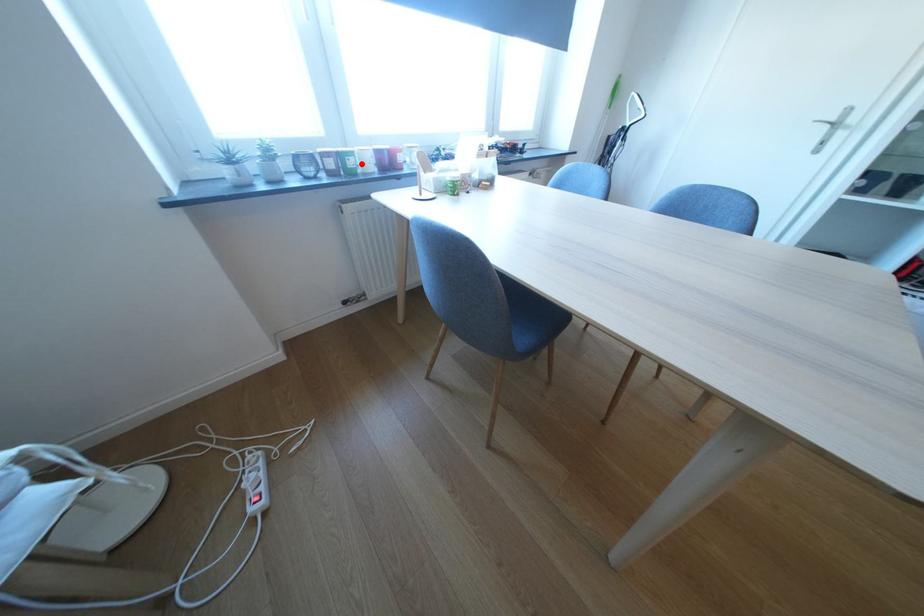
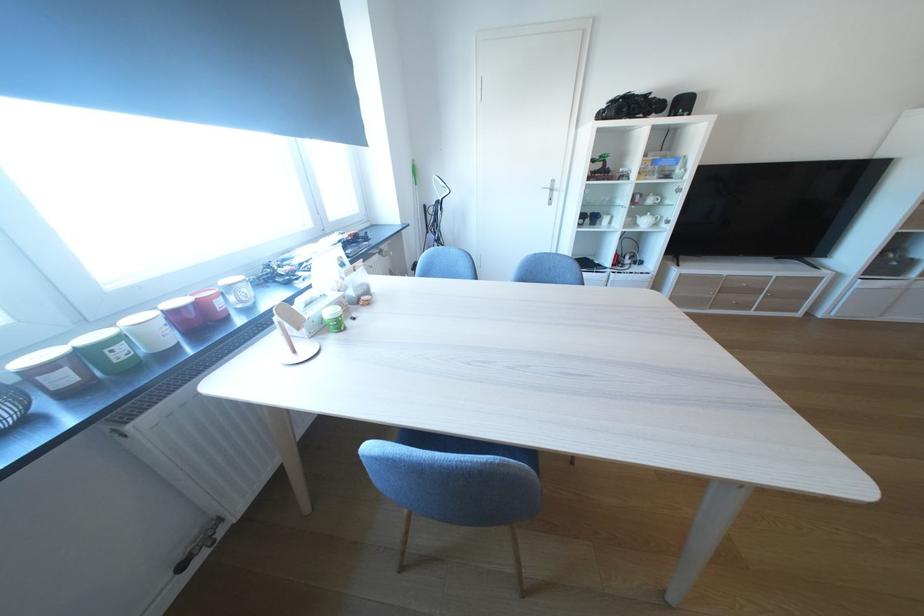
Question: I am providing you with two images of the same scene from different viewpoints. In image1, a red point is highlighted. Considering the same 3D point in image2, which of the following is correct?

Choices:
 (A) It is closer
 (B) It is farther

Answer: (B)